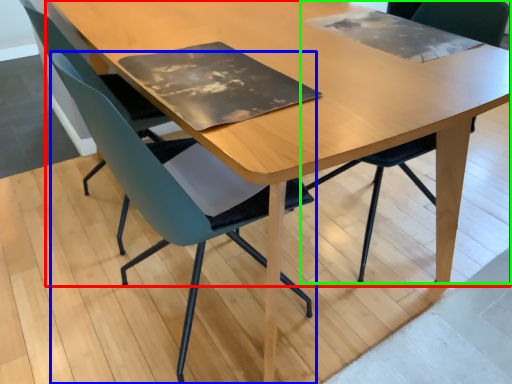
Question: Which is nearer to the table (highlighted by a red box)? chair (highlighted by a blue box) or chair (highlighted by a green box).

Choices:
 (A) chair
 (B) chair

Answer: (A)